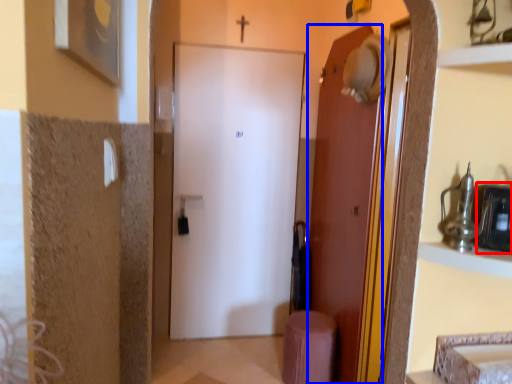
Question: Which point is closer to the camera, medicine cabinet (highlighted by a red box) or door (highlighted by a blue box)?

Choices:
 (A) medicine cabinet
 (B) door

Answer: (A)